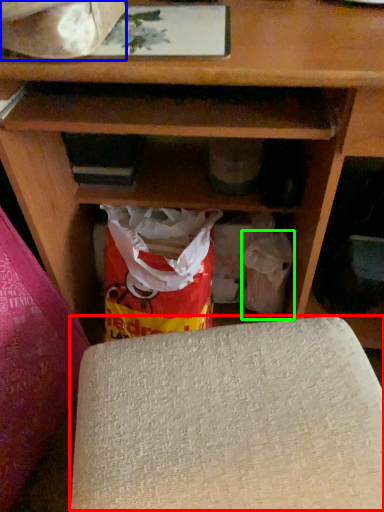
Question: Which is nearer to the yoga mat (highlighted by a red box)? wrapping paper (highlighted by a blue box) or grocery bag (highlighted by a green box).

Choices:
 (A) wrapping paper
 (B) grocery bag

Answer: (B)